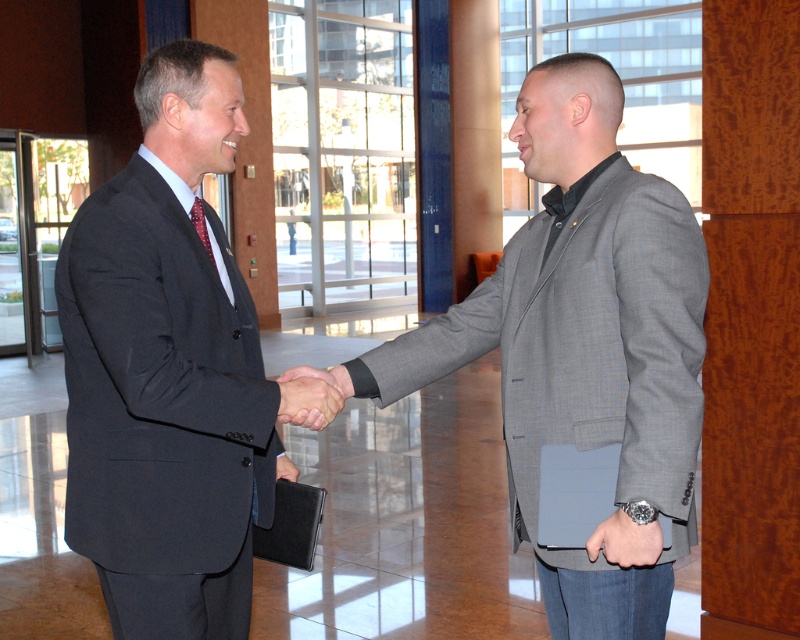
Question: Which of the following is the closest to the observer?

Choices:
 (A) gray textured blazer at center
 (B) matte black hand at center

Answer: (A)

Question: Is matte black suit at center thinner than matte black hand at center?

Choices:
 (A) yes
 (B) no

Answer: (B)

Question: Where is gray textured blazer at center located in relation to matte black hand at center in the image?

Choices:
 (A) below
 (B) above

Answer: (B)

Question: Is matte black suit at center further to camera compared to gray textured blazer at center?

Choices:
 (A) no
 (B) yes

Answer: (B)

Question: Which point is farther from the camera taking this photo?

Choices:
 (A) (152, 620)
 (B) (640, 340)
 (C) (320, 400)

Answer: (C)

Question: Which of the following is the closest to the observer?

Choices:
 (A) matte black suit at center
 (B) gray textured blazer at center
 (C) matte black hand at center

Answer: (B)